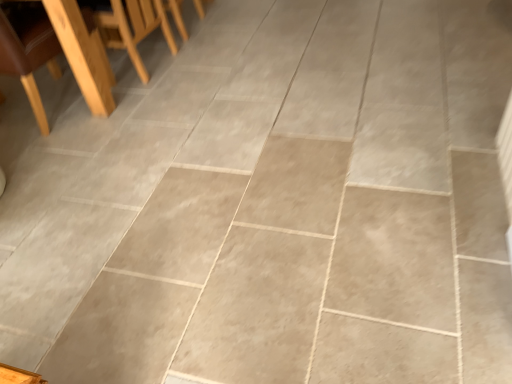
You are a GUI agent. You are given a task and a screenshot of the screen. Output one action in this format:
    pyautogui.click(x=<x>, y=<y>)
    Task: Click on the unoccupied region to the right of wooden chair at upper left
    This screenshot has width=512, height=384.
    Given the screenshot: What is the action you would take?
    pyautogui.click(x=148, y=94)